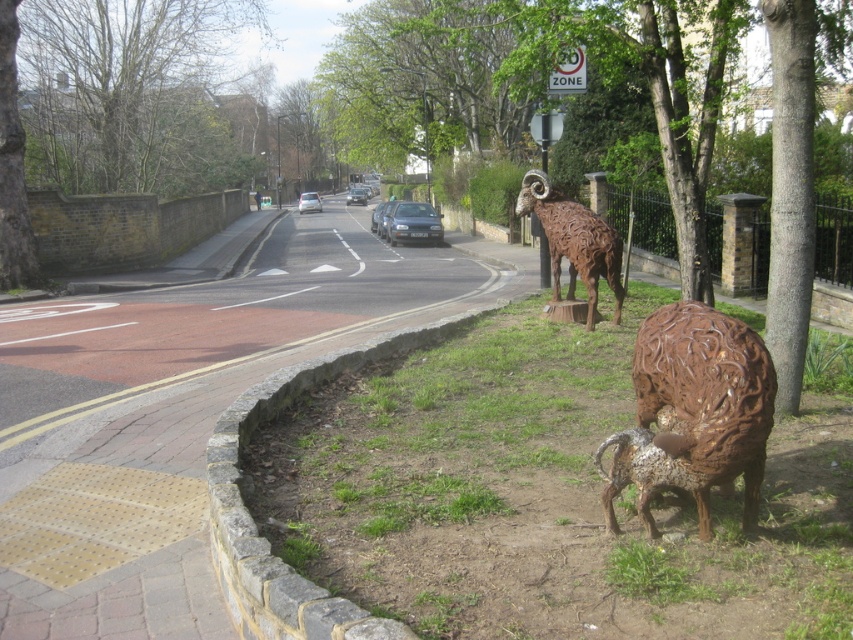
Question: Is silver metallic car at center smaller than metallic silver car at center?

Choices:
 (A) yes
 (B) no

Answer: (B)

Question: Does brown stone curb at lower center have a larger size compared to metallic silver car at center?

Choices:
 (A) yes
 (B) no

Answer: (B)

Question: Which point is farther from the camera taking this photo?

Choices:
 (A) (357, 189)
 (B) (422, 230)

Answer: (A)

Question: Which is farther from the green grass at center?

Choices:
 (A) rusty metal ram at center-right
 (B) metallic silver car at center

Answer: (B)

Question: Can you confirm if satin black car at center is bigger than silver metallic car at center?

Choices:
 (A) yes
 (B) no

Answer: (B)

Question: Estimate the real-world distances between objects in this image. Which object is closer to the green grass at center?

Choices:
 (A) silver metallic car at center
 (B) metallic silver car at center

Answer: (A)